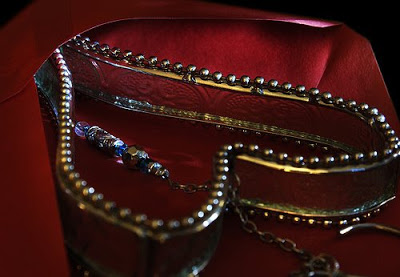
You are a GUI agent. You are given a task and a screenshot of the screen. Output one action in this format:
    pyautogui.click(x=<x>, y=<y>)
    Task: Click on the decorative pattern
    This screenshot has width=400, height=277.
    Given the screenshot: What is the action you would take?
    pyautogui.click(x=140, y=87), pyautogui.click(x=163, y=90), pyautogui.click(x=209, y=99)